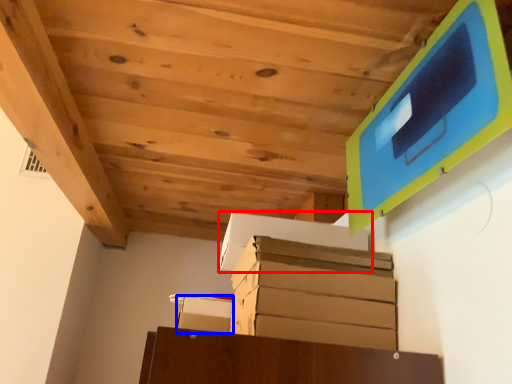
Question: Among these objects, which one is farthest to the camera, cardboard box (highlighted by a red box) or cardboard box (highlighted by a blue box)?

Choices:
 (A) cardboard box
 (B) cardboard box

Answer: (B)